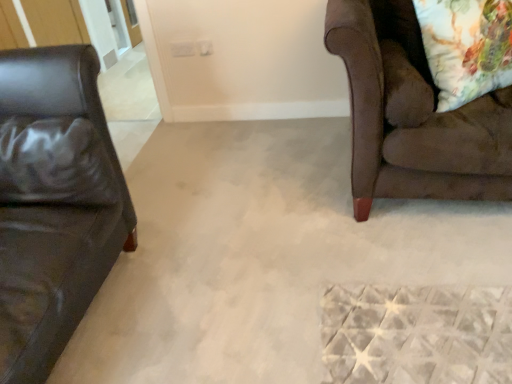
Question: Visually, is black leather pillow at left positioned to the left or to the right of brown suede couch at right?

Choices:
 (A) left
 (B) right

Answer: (A)

Question: Considering the positions of point (30, 201) and point (497, 167), is point (30, 201) closer or farther from the camera than point (497, 167)?

Choices:
 (A) closer
 (B) farther

Answer: (A)

Question: Estimate the real-world distances between objects in this image. Which object is closer to the black leather pillow at left?

Choices:
 (A) brown suede couch at right
 (B) floral fabric pillow at upper right

Answer: (A)

Question: Estimate the real-world distances between objects in this image. Which object is closer to the floral fabric pillow at upper right?

Choices:
 (A) black leather pillow at left
 (B) brown suede couch at right

Answer: (B)